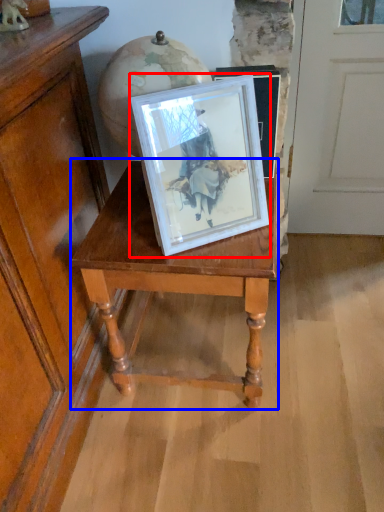
Question: Which point is further to the camera, picture frame (highlighted by a red box) or table (highlighted by a blue box)?

Choices:
 (A) picture frame
 (B) table

Answer: (B)